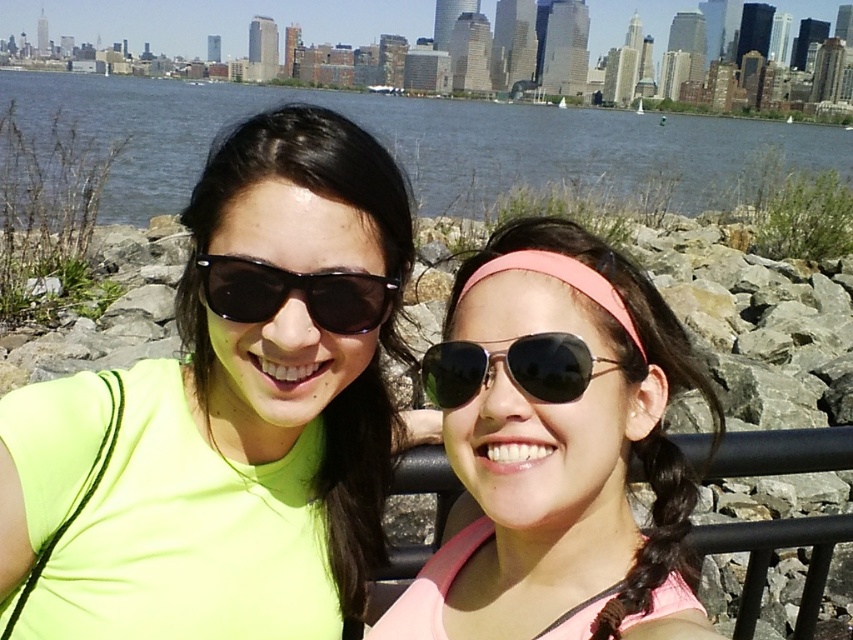
Question: Estimate the real-world distances between objects in this image. Which object is closer to the metallic aviator sunglasses at center?

Choices:
 (A) blue water at upper center
 (B) black plastic sunglasses at center

Answer: (B)

Question: Does black plastic sunglasses at center have a smaller size compared to metallic aviator sunglasses at center?

Choices:
 (A) yes
 (B) no

Answer: (B)

Question: Which object is farther from the camera taking this photo?

Choices:
 (A) neon yellow fabric at center
 (B) black plastic sunglasses at center

Answer: (B)

Question: Does neon yellow fabric at center lie behind blue water at upper center?

Choices:
 (A) no
 (B) yes

Answer: (A)

Question: Which point is farther to the camera?

Choices:
 (A) (218, 192)
 (B) (445, 392)

Answer: (A)

Question: Is blue water at upper center above metallic aviator sunglasses at center?

Choices:
 (A) no
 (B) yes

Answer: (B)